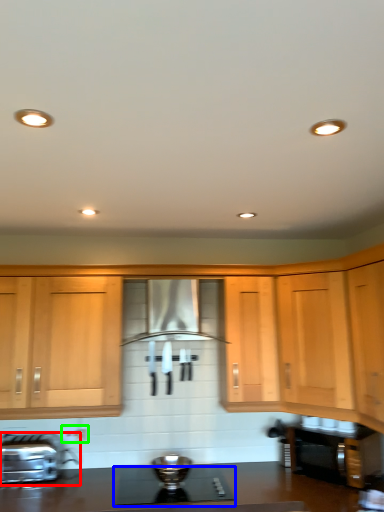
Question: Which object is positioned closest to kitchen appliance (highlighted by a red box)? Select from gas stove (highlighted by a blue box) and electric outlet (highlighted by a green box).

Choices:
 (A) gas stove
 (B) electric outlet

Answer: (B)